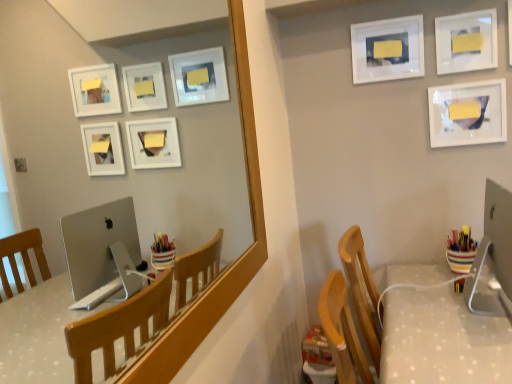
Question: From their relative heights in the image, would you say sleek silver monitor at right is taller or shorter than multicolored plastic cup at right?

Choices:
 (A) tall
 (B) short

Answer: (A)

Question: In the image, is sleek silver monitor at right positioned in front of or behind multicolored plastic cup at right?

Choices:
 (A) behind
 (B) front

Answer: (B)

Question: Considering the real-world distances, which object is closest to the white glossy picture frame at upper right, the 2th picture frame from the left?

Choices:
 (A) white glossy picture frame at upper right, acting as the 3th picture frame starting from the left
 (B) white dotted fabric table at lower right
 (C) white matte picture frame at upper center, marked as the 3th picture frame in a right-to-left arrangement
 (D) sleek silver monitor at right
 (E) matte wooden mirror at upper center

Answer: (A)

Question: Estimate the real-world distances between objects in this image. Which object is farther from the sleek silver monitor at right?

Choices:
 (A) matte wooden mirror at upper center
 (B) white dotted fabric table at lower right
 (C) multicolored plastic cup at right
 (D) white glossy picture frame at upper right, acting as the second picture frame starting from the right
 (E) white glossy picture frame at upper right, which is the 1th picture frame from right to left

Answer: (A)